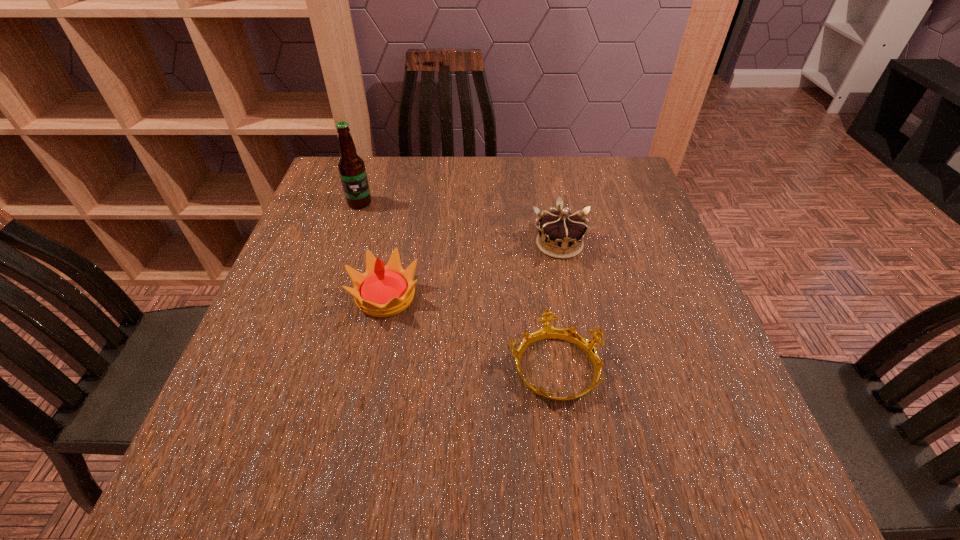
Image resolution: width=960 pixels, height=540 pixels. What are the coordinates of `free space located 0.320m on the left of the nearest object` in the screenshot? It's located at (334, 367).

Where is `object that is at the far edge`? The image size is (960, 540). object that is at the far edge is located at coordinates (351, 167).

You are a GUI agent. You are given a task and a screenshot of the screen. Output one action in this format:
    pyautogui.click(x=<x>, y=<y>)
    Task: Click on the object at the left edge
    
    Given the screenshot: What is the action you would take?
    pyautogui.click(x=351, y=167)

Where is `object located at the far left corner`? Image resolution: width=960 pixels, height=540 pixels. object located at the far left corner is located at coordinates (351, 167).

Where is `vacant space at the far edge`? This screenshot has width=960, height=540. vacant space at the far edge is located at coordinates (429, 158).

In the image, there is a desktop. Where is `vacant space at the left edge`? This screenshot has height=540, width=960. vacant space at the left edge is located at coordinates (251, 410).

This screenshot has width=960, height=540. What are the coordinates of `blank space at the right edge of the desktop` in the screenshot? It's located at (651, 338).

The width and height of the screenshot is (960, 540). In the image, there is a desktop. Find the location of `vacant space at the near left corner`. vacant space at the near left corner is located at coordinates (201, 495).

At what (x,y) coordinates should I click in order to perform the action: click on vacant area at the far right corner. Please return your answer as a coordinate pair (x, y). Looking at the image, I should click on (578, 159).

This screenshot has height=540, width=960. In order to click on free area in between the second farthest object and the beer bottle in this screenshot , I will do `click(460, 224)`.